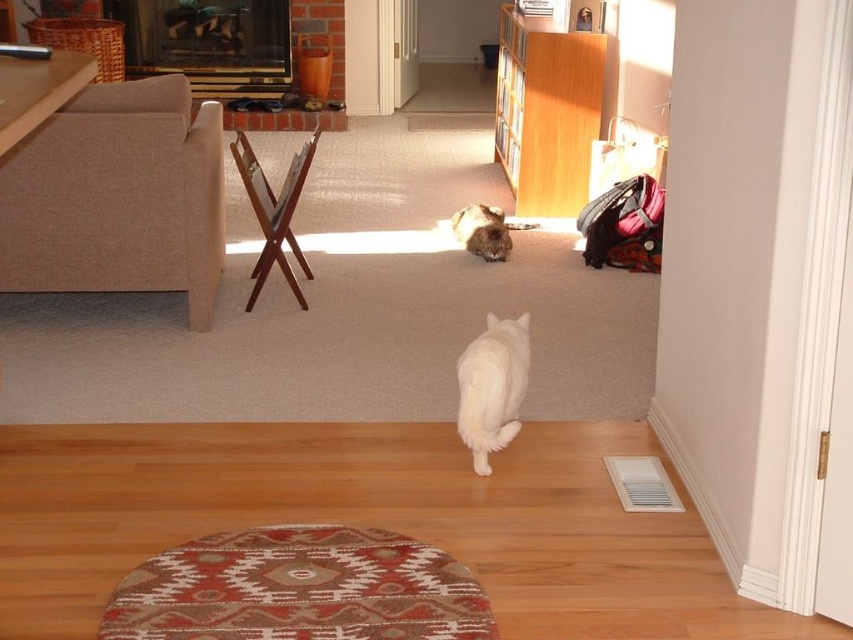
Question: Which of the following is the closest to the observer?

Choices:
 (A) (467, 344)
 (B) (479, 230)

Answer: (A)

Question: Which object is farther from the camera taking this photo?

Choices:
 (A) fuzzy brown cat at center
 (B) wooden bookshelf at upper center

Answer: (B)

Question: Can you confirm if wooden bookshelf at upper center is positioned to the right of fuzzy brown cat at center?

Choices:
 (A) no
 (B) yes

Answer: (B)

Question: Is wooden bookshelf at upper center thinner than fuzzy brown cat at center?

Choices:
 (A) no
 (B) yes

Answer: (A)

Question: Does white fluffy cat at center have a smaller size compared to fuzzy brown cat at center?

Choices:
 (A) yes
 (B) no

Answer: (B)

Question: Which of the following is the closest to the observer?

Choices:
 (A) white fluffy cat at center
 (B) wooden bookshelf at upper center
 (C) fuzzy brown cat at center

Answer: (A)